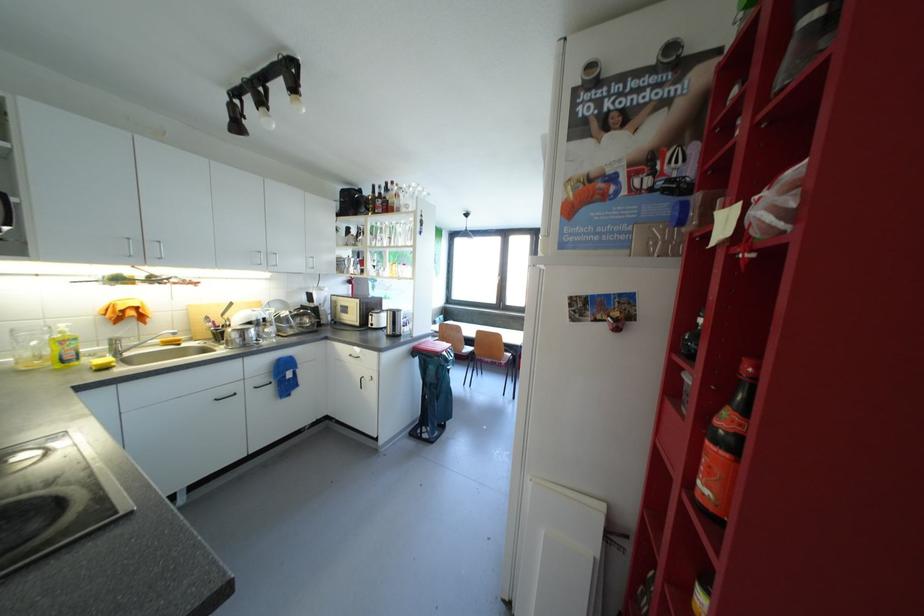
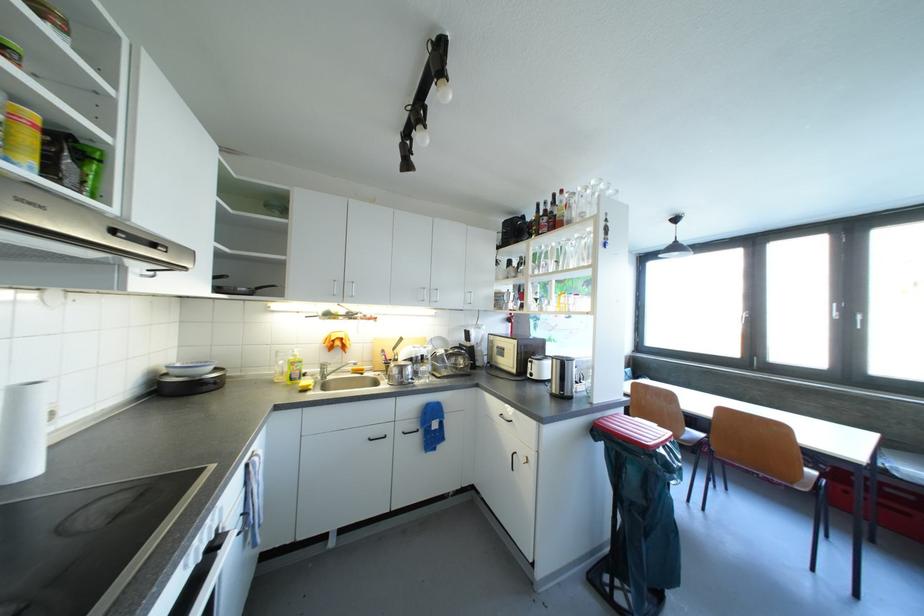
Where in the second image is the point corresponding to (54,365) from the first image?

(290, 382)